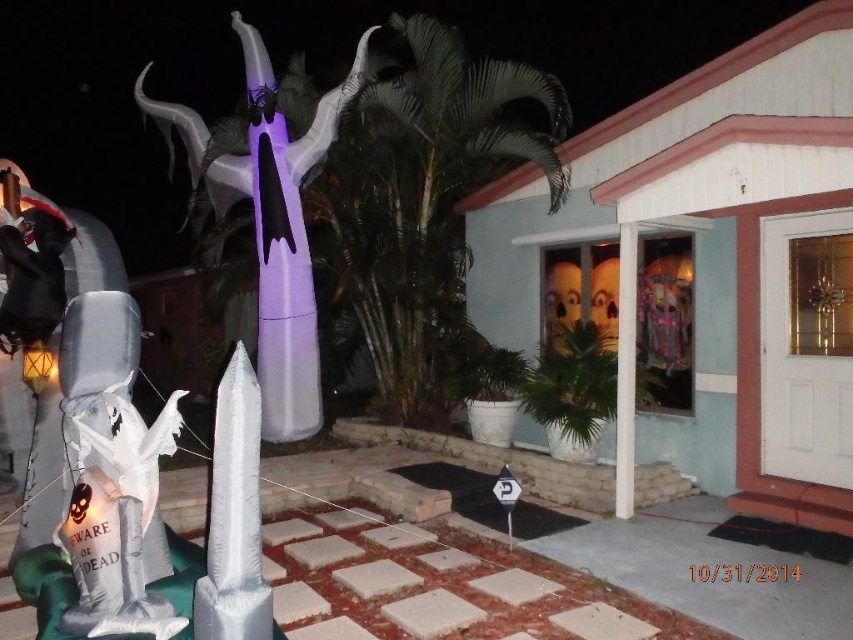
Is white glossy ghost at lower left taller than purple inflatable ghost at center?

Incorrect, white glossy ghost at lower left's height is not larger of purple inflatable ghost at center's.

Does point (80, 364) come behind point (265, 99)?

No, it is not.

Where is `white glossy ghost at lower left`? white glossy ghost at lower left is located at coordinates (112, 474).